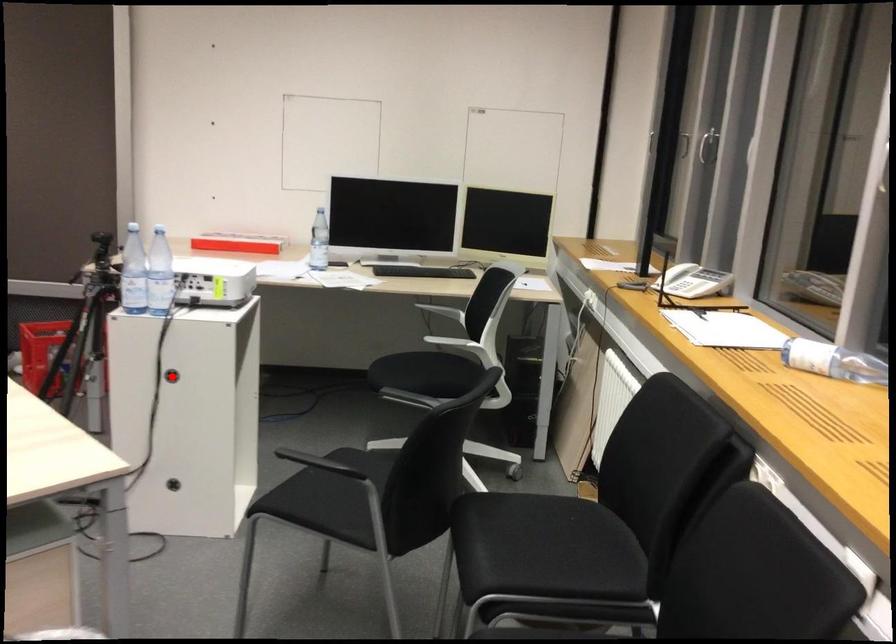
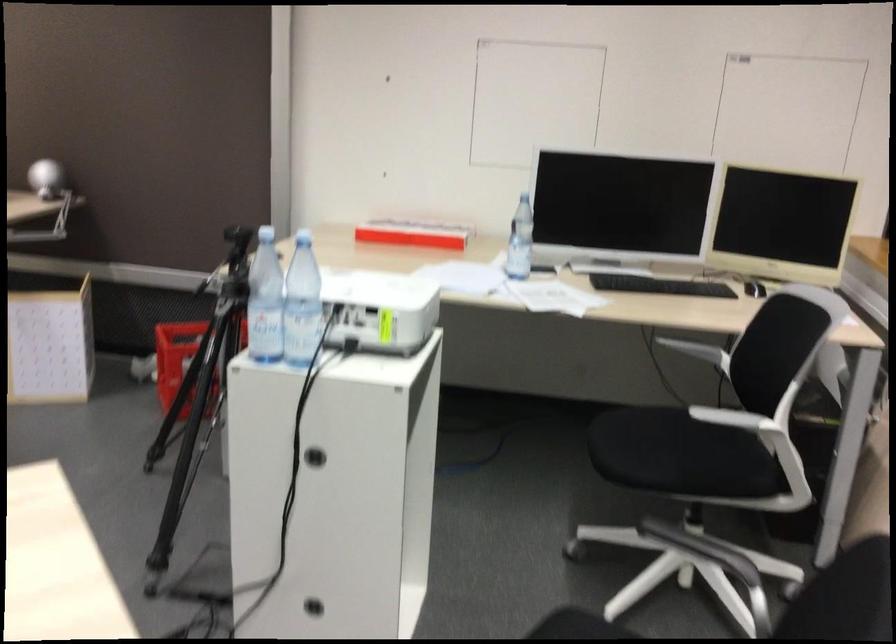
Question: I am providing you with two images of the same scene from different viewpoints. Given a red point in image1, look at the same physical point in image2. Is it:

Choices:
 (A) Closer to the viewpoint
 (B) Farther from the viewpoint

Answer: (A)